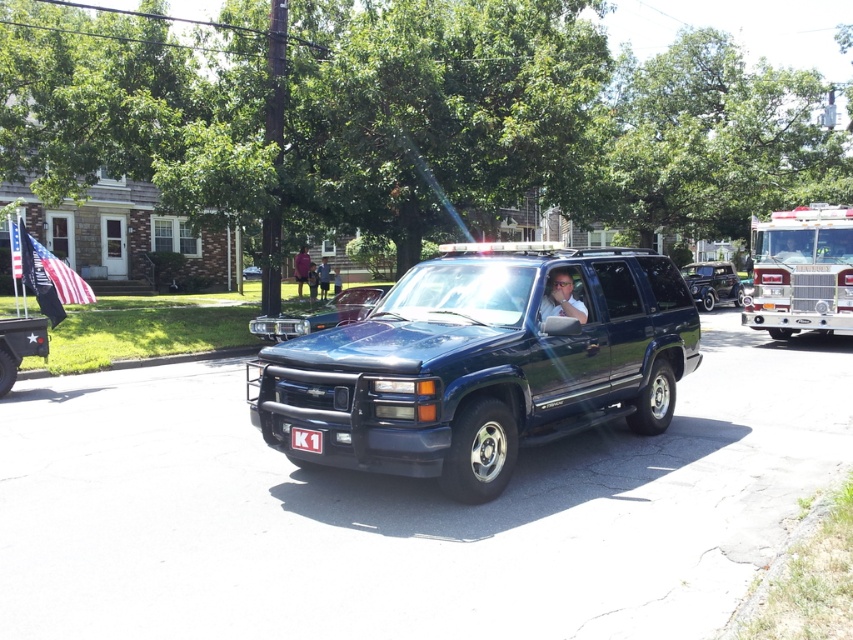
You are a photographer trying to capture both the glossy dark blue suv at center and the red metallic fire truck at right in a single shot. Based on their positions, which vehicle should you focus on first to ensure both are in frame?

You should focus on the glossy dark blue suv at center first since it is positioned to the left of the red metallic fire truck at right, allowing you to frame both vehicles by adjusting your angle to include the fire truck on the right side of the image.

You are a pedestrian standing on the sidewalk and see the glossy dark blue suv at center approaching. If the suv is moving at 3 mph, how many seconds will it take for the suv to reach you?

The glossy dark blue suv at center is 17.49 feet away from viewer. At 3 mph, it would take approximately 4 seconds to reach you.